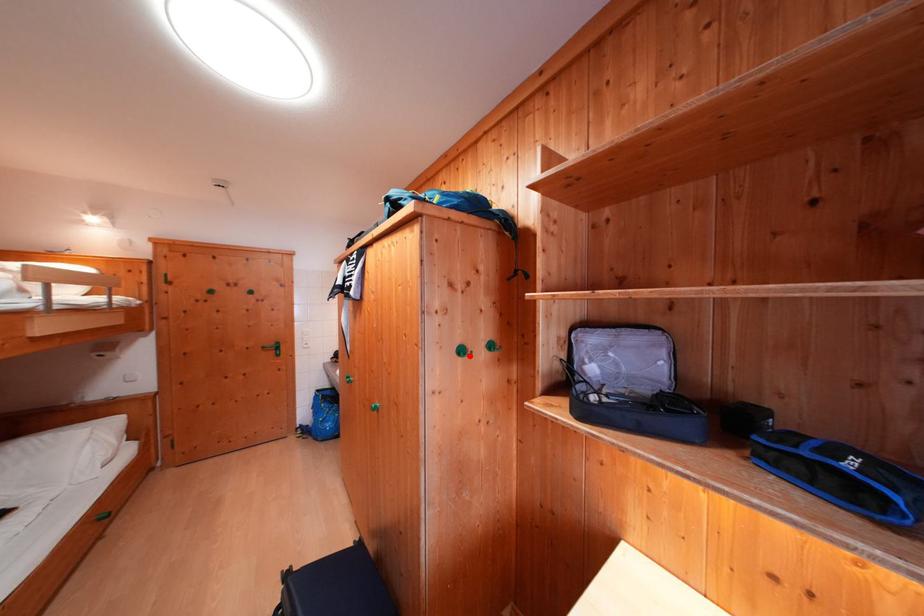
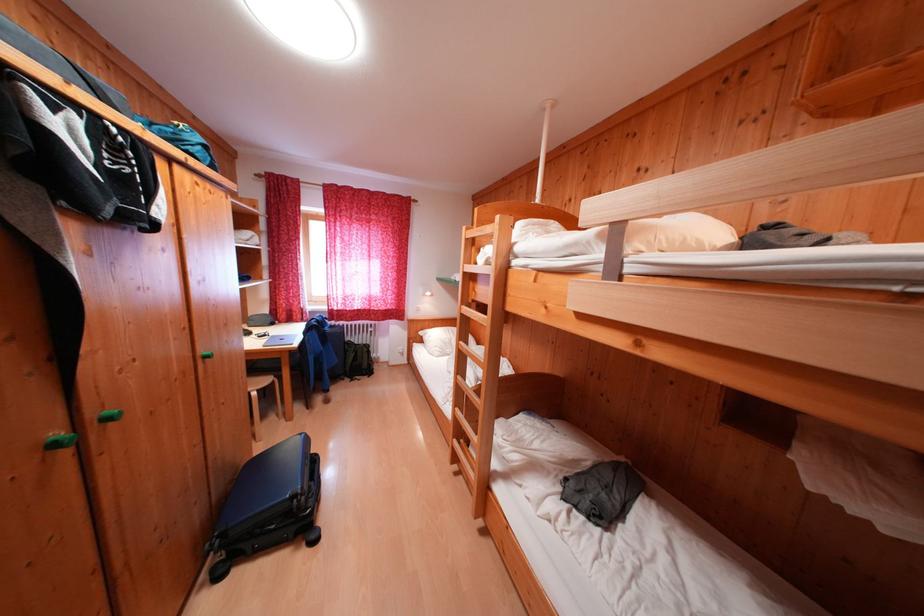
Question: I am providing you with two images of the same scene from different viewpoints. A red point is marked on the first image. Is the red point's position out of view in image 2?

Choices:
 (A) Yes
 (B) No

Answer: (A)